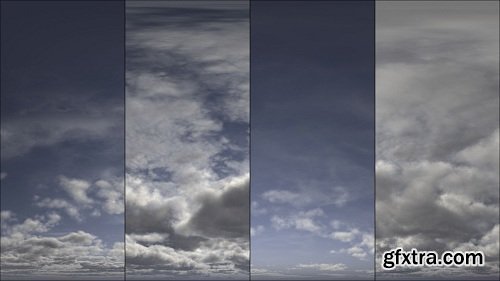
Identify the location of light. (x=165, y=182).